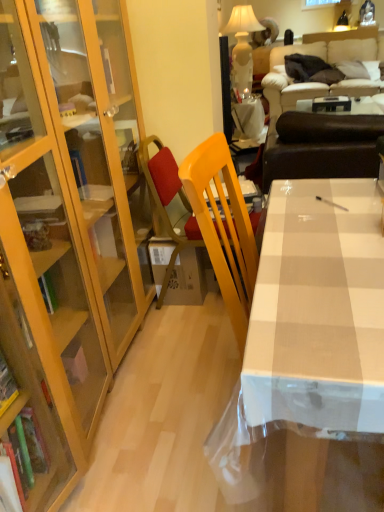
Question: Is point (362, 505) closer or farther from the camera than point (302, 99)?

Choices:
 (A) closer
 (B) farther

Answer: (A)

Question: From a real-world perspective, is white glossy table at center positioned above or below white glossy table at center, which is the second table in back-to-front order?

Choices:
 (A) below
 (B) above

Answer: (A)

Question: Estimate the real-world distances between objects in this image. Which object is farther from the yellow matte chair at center?

Choices:
 (A) beige fabric couch at upper right, arranged as the 2th studio couch when viewed from the front
 (B) white glossy table at upper center, the second table in the front-to-back sequence
 (C) white glossy table at center, which ranks as the 2th table in left-to-right order
 (D) white ceramic lamp at upper center
 (E) white glossy table at center

Answer: (A)

Question: Estimate the real-world distances between objects in this image. Which object is closer to the white glossy table at upper center, the second table viewed from the right?

Choices:
 (A) white glossy table at center, the 1th table from the right
 (B) brown leather couch at upper right, placed as the second studio couch when sorted from back to front
 (C) white ceramic lamp at upper center
 (D) yellow matte chair at center
 (E) beige fabric couch at upper right, arranged as the 2th studio couch when viewed from the front

Answer: (B)